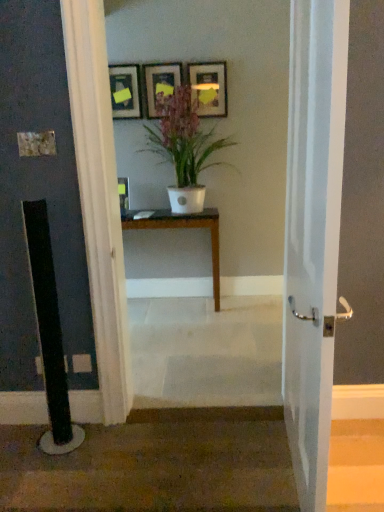
Identify the location of vacant space to the right of wooden table at center. (241, 316).